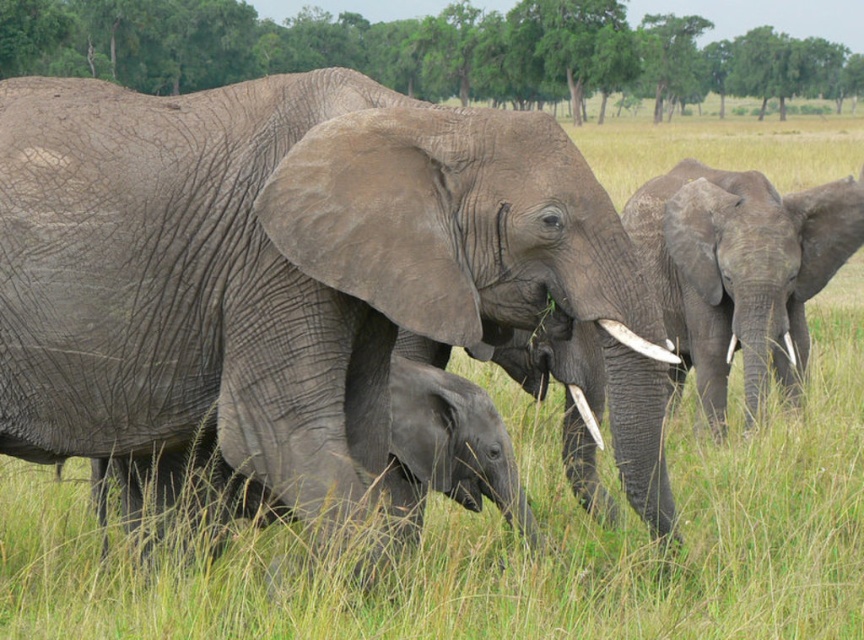
You are a wildlife photographer aiming to capture a closeup of the white glossy tusk at lower right. However, the gray rough elephant at right is blocking your view. Can you move around the elephant to get an unobstructed shot of the tusk?

The gray rough elephant at right is positioned over the white glossy tusk at lower right, so moving around the elephant might allow you to get an unobstructed view of the tusk.